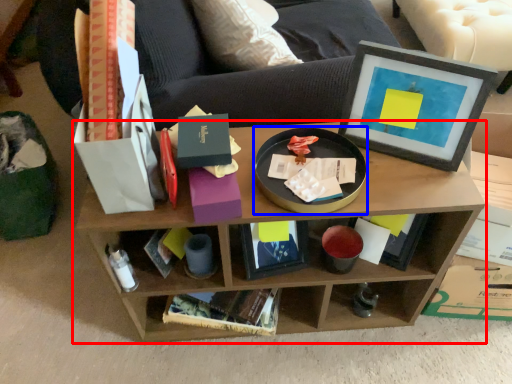
Question: Which object is further to the camera taking this photo, shelf (highlighted by a red box) or round table (highlighted by a blue box)?

Choices:
 (A) shelf
 (B) round table

Answer: (A)